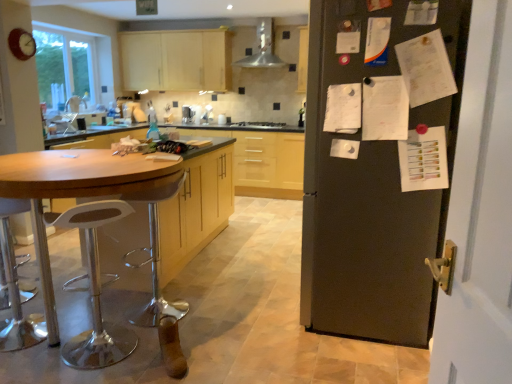
Question: From the image's perspective, is matte black refrigerator at right positioned above or below white plastic bar stool at left, the first bar stool in the front-to-back sequence?

Choices:
 (A) below
 (B) above

Answer: (B)

Question: Relative to white plastic bar stool at left, the second bar stool in the back-to-front sequence, is matte black refrigerator at right in front or behind?

Choices:
 (A) front
 (B) behind

Answer: (B)

Question: Considering the real-world distances, which object is closest to the satin silver stove at center?

Choices:
 (A) white plastic bar stool at left, the second bar stool in the back-to-front sequence
 (B) matte black refrigerator at right
 (C) wooden table at left
 (D) matte wood cabinets at upper center, which ranks as the first cabinetry in top-to-bottom order
 (E) metallic clock at upper left

Answer: (D)

Question: Based on their relative distances, which object is farther from the white plastic bar stool at left, the first bar stool in the front-to-back sequence?

Choices:
 (A) matte black refrigerator at right
 (B) metallic silver bar stool at left, the second bar stool viewed from the front
 (C) yellow wood cabinets at center, the 1th cabinetry positioned from the bottom
 (D) matte wood cabinets at upper center, which is the 2th cabinetry in bottom-to-top order
 (E) satin silver stove at center

Answer: (D)